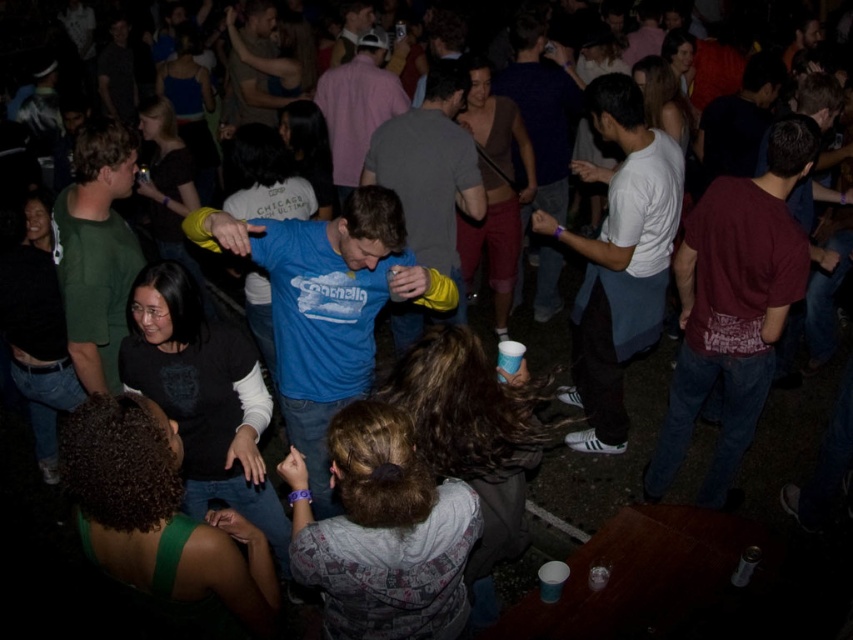
Who is more distant from viewer, (714, 285) or (345, 99)?

Positioned behind is point (345, 99).

Does point (694, 266) come behind point (347, 97)?

No.

Is point (772, 198) behind point (402, 92)?

That is False.

Image resolution: width=853 pixels, height=640 pixels. Identify the location of maroon t-shirt at right. 734,305.

Does maroon t-shirt at right lie behind white cotton shirt at center-right?

That is False.

Is maroon t-shirt at right smaller than white cotton shirt at center-right?

Correct, maroon t-shirt at right occupies less space than white cotton shirt at center-right.

Who is more forward, [734,408] or [643,330]?

Point [734,408]

The height and width of the screenshot is (640, 853). Identify the location of maroon t-shirt at right. (734, 305).

Is point (112, 250) closer to camera compared to point (357, 161)?

Yes, point (112, 250) is closer to viewer.

Is point (100, 376) farther from camera compared to point (389, 80)?

No, (100, 376) is in front of (389, 80).

You are a GUI agent. You are given a task and a screenshot of the screen. Output one action in this format:
    pyautogui.click(x=<x>, y=<y>)
    Task: Click on the green matte shirt at left
    Image resolution: width=853 pixels, height=640 pixels.
    Given the screenshot: What is the action you would take?
    pyautogui.click(x=96, y=250)